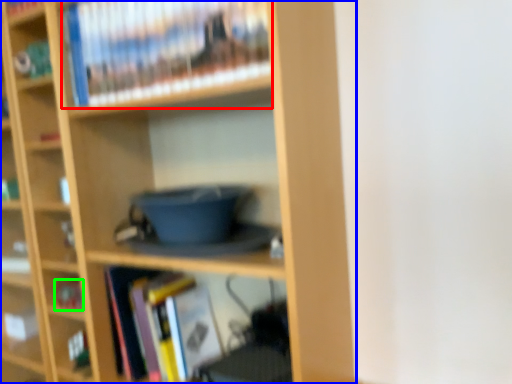
Question: Which object is the closest to the book (highlighted by a red box)? Choose among these: bookcase (highlighted by a blue box) or book (highlighted by a green box).

Choices:
 (A) bookcase
 (B) book

Answer: (A)